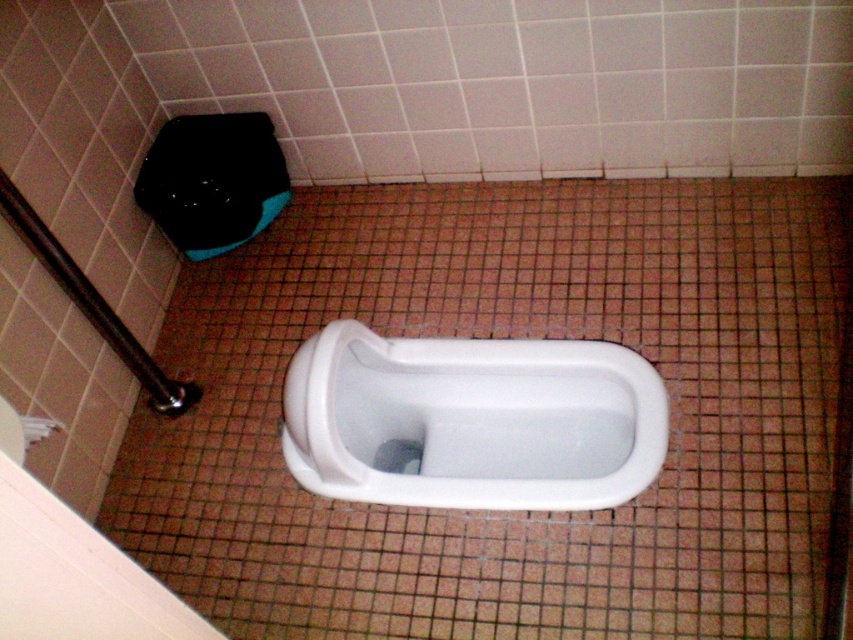
You are standing in the restroom and want to reach a point that is in front of another point. Which point should you move towards first, point (387,609) or point (561,356)?

You should move towards point (387,609) first because it is in front of point (561,356).

You need to clean the restroom and are standing in front of the white glossy tile at center and the white glossy urinal at center. Which one is located higher up?

The white glossy tile at center is positioned over the white glossy urinal at center, so the white glossy tile at center is higher up.

You are standing in the restroom and want to place a small decorative item exactly at the center of the white glossy tile at center. According to the image, where should you position the item?

The white glossy tile at center is located at point (509, 337), so you should position the item at those coordinates to place it exactly at the center of the white glossy tile at center.